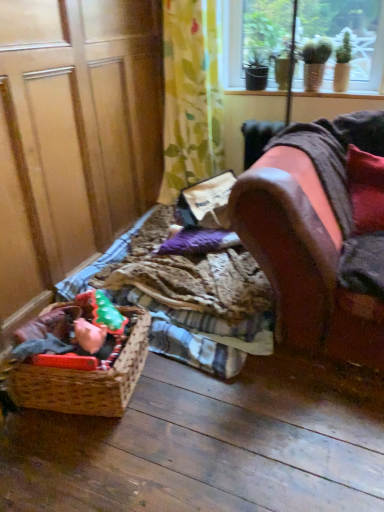
Question: Considering their positions, is velvet red pillow at right located in front of or behind plaid fabric at lower left?

Choices:
 (A) behind
 (B) front

Answer: (A)

Question: Considering the positions of point (347, 164) and point (225, 353), is point (347, 164) closer or farther from the camera than point (225, 353)?

Choices:
 (A) farther
 (B) closer

Answer: (A)

Question: Estimate the real-world distances between objects in this image. Which object is farther from the green floral fabric at upper center?

Choices:
 (A) velvet red pillow at right
 (B) wooden screen door at lower left
 (C) woven brown basket at lower left
 (D) white painted wood at upper center
 (E) plaid fabric at lower left

Answer: (C)

Question: Considering the real-world distances, which object is closest to the green floral fabric at upper center?

Choices:
 (A) woven brown basket at lower left
 (B) leather couch at right
 (C) wooden screen door at lower left
 (D) plaid fabric at lower left
 (E) white painted wood at upper center

Answer: (E)